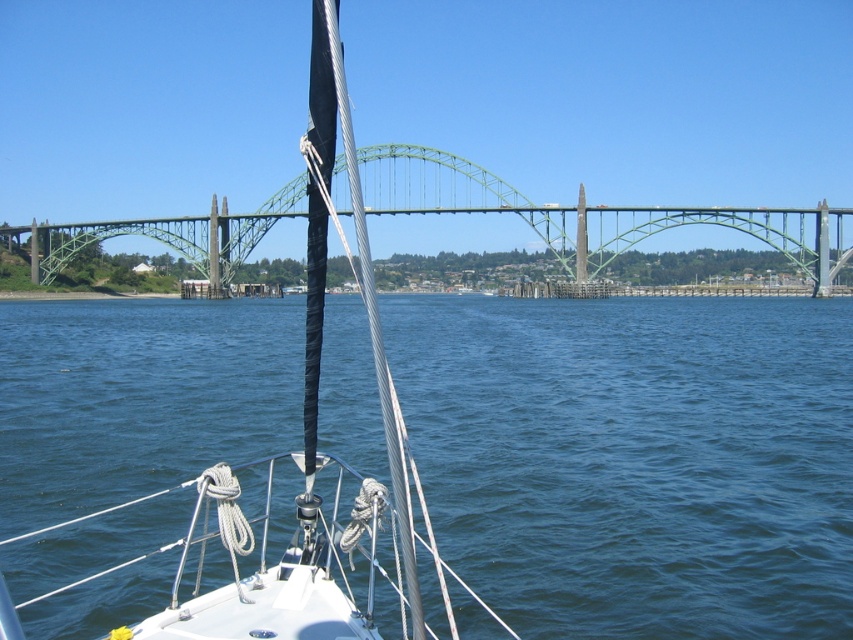
You are on a sailboat and want to navigate towards the green metallic bridge at center. Based on the scene, which direction should you steer to approach the bridge from the blue water at center?

You should steer to the left since the blue water at center is to the right of the green metallic bridge at center, so moving left would bring you towards the bridge.

Looking at this image, you are navigating a sailboat and need to pass through a narrow channel between two objects. The channel is formed by the blue water at center and the green metallic bridge at center. Can your sailboat safely pass through the channel if its width is 10 meters?

The blue water at center is narrower than the green metallic bridge at center. Since the blue water at center has a smaller width, it determines the channel width. If the blue water at center is less than 10 meters wide, the sailboat cannot pass. However, the exact width isn not provided, so we can only conclude the bridge is wider but not the water.

You are navigating a sailboat and need to determine the distance between two points on the water ahead. The points are labeled as point 1 at coordinates point (693, 444) and point 2 at coordinates point (389, 456). Based on the scene, which point is closer to your current position on the sailboat?

Point 1 at coordinates point (693, 444) is closer to your current position on the sailboat because it is further to the viewer than point 2 at coordinates point (389, 456).